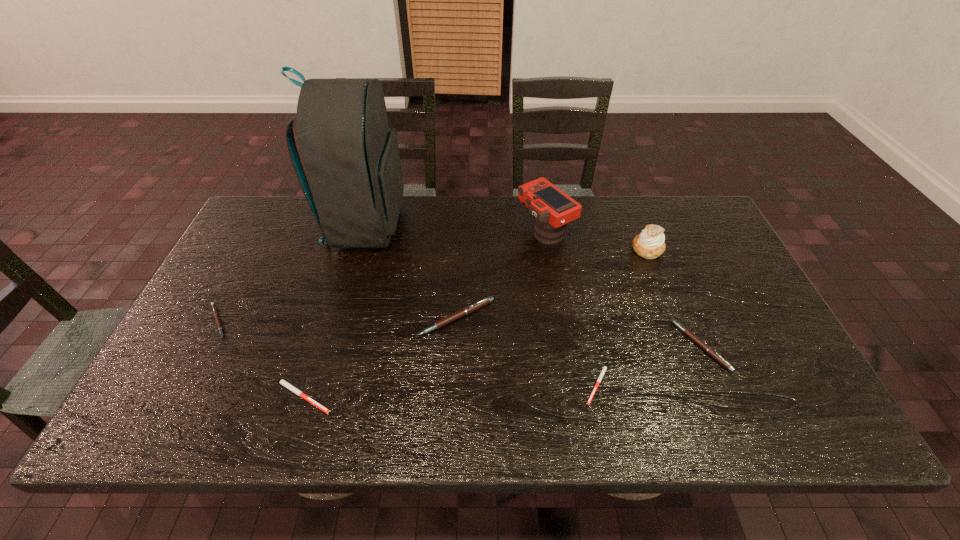
Find the location of `vacant area that lies between the fourth object from left to right and the rightmost pink pen`. vacant area that lies between the fourth object from left to right and the rightmost pink pen is located at coordinates (579, 332).

Image resolution: width=960 pixels, height=540 pixels. I want to click on free spot between the rightmost pen and the tallest object, so click(533, 285).

Locate an element on the screen. The height and width of the screenshot is (540, 960). free space between the fifth shortest object and the second pen from left to right is located at coordinates (379, 357).

This screenshot has width=960, height=540. What are the coordinates of `object that is the fourth closest to the leftmost object` in the screenshot? It's located at (552, 208).

At what (x,y) coordinates should I click in order to perform the action: click on object that is the sixth closest one to the fourth object from left to right. Please return your answer as a coordinate pair (x, y). Looking at the image, I should click on (709, 350).

You are a GUI agent. You are given a task and a screenshot of the screen. Output one action in this format:
    pyautogui.click(x=<x>, y=<y>)
    Task: Click on the second closest pen to the second tallest pen
    The image size is (960, 540).
    Given the screenshot: What is the action you would take?
    pyautogui.click(x=477, y=305)

Select which pen is the third closest to the right white pen. Please provide its 2D coordinates. Your answer should be formatted as a tuple, i.e. [(x, y)], where the tuple contains the x and y coordinates of a point satisfying the conditions above.

[(281, 381)]

Identify which pink pen is located as the nearest to the leftmost object. Please provide its 2D coordinates. Your answer should be formatted as a tuple, i.e. [(x, y)], where the tuple contains the x and y coordinates of a point satisfying the conditions above.

[(477, 305)]

Select which pink pen is the second closest to the backpack. Please provide its 2D coordinates. Your answer should be formatted as a tuple, i.e. [(x, y)], where the tuple contains the x and y coordinates of a point satisfying the conditions above.

[(215, 313)]

What are the coordinates of `free spot that satisfies the following two spatial constraints: 1. at the nib of the tallest pen; 2. at the nib of the leftmost pink pen` in the screenshot? It's located at (456, 321).